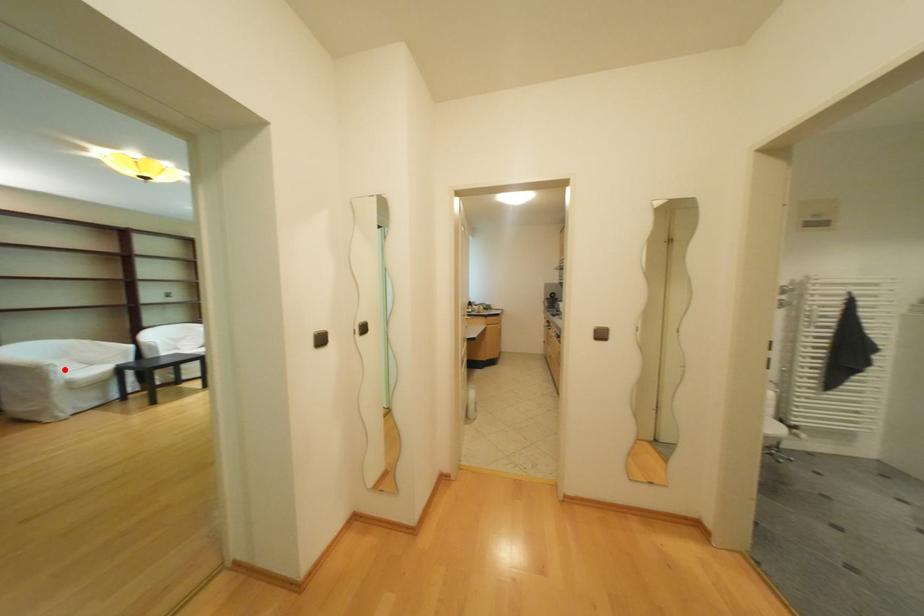
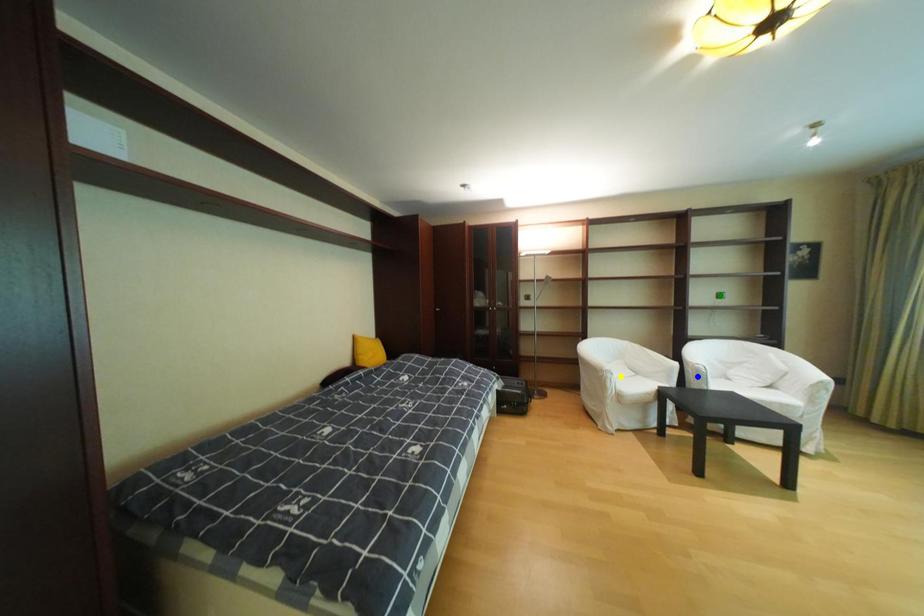
Question: I am providing you with two images of the same scene from different viewpoints. A red point is marked on the first image. You are given multiple points on the second image. Which point in image 2 is actually the same real-world point as the red point in image 1?

Choices:
 (A) yellow point
 (B) green point
 (C) blue point

Answer: (A)